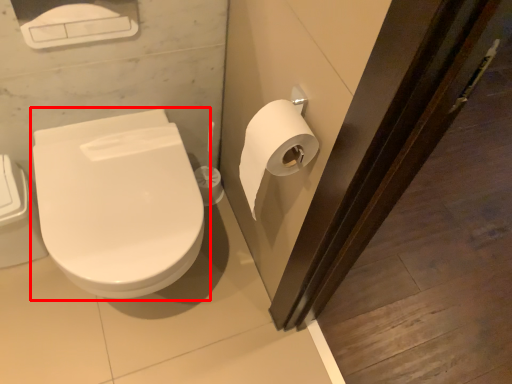
Question: From the image's perspective, where is toilet (annotated by the red box) located in relation to toilet paper in the image?

Choices:
 (A) above
 (B) below

Answer: (B)